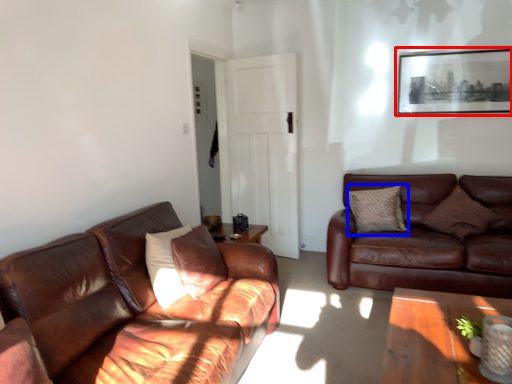
Question: Which point is closer to the camera, picture frame (highlighted by a red box) or pillow (highlighted by a blue box)?

Choices:
 (A) picture frame
 (B) pillow

Answer: (B)